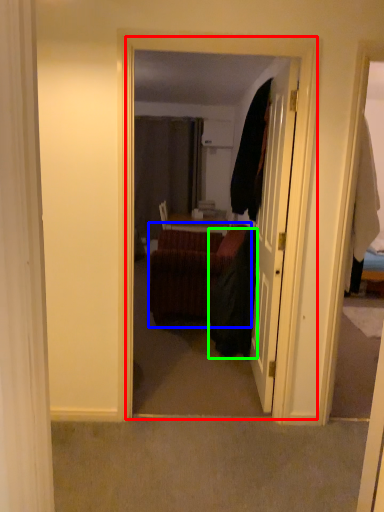
Question: Estimate the real-world distances between objects in this image. Which object is closer to corridor (highlighted by a red box), studio couch (highlighted by a blue box) or robe (highlighted by a green box)?

Choices:
 (A) studio couch
 (B) robe

Answer: (B)